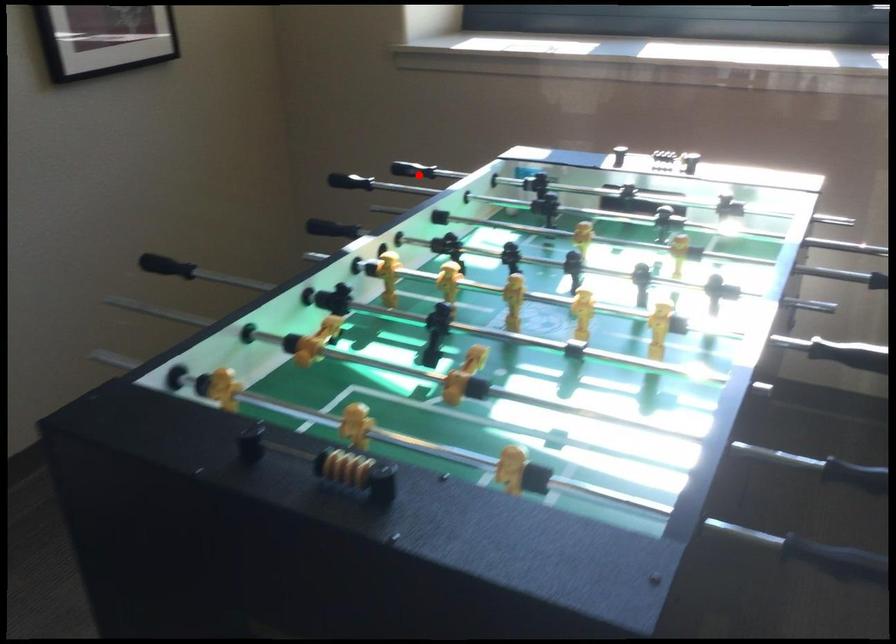
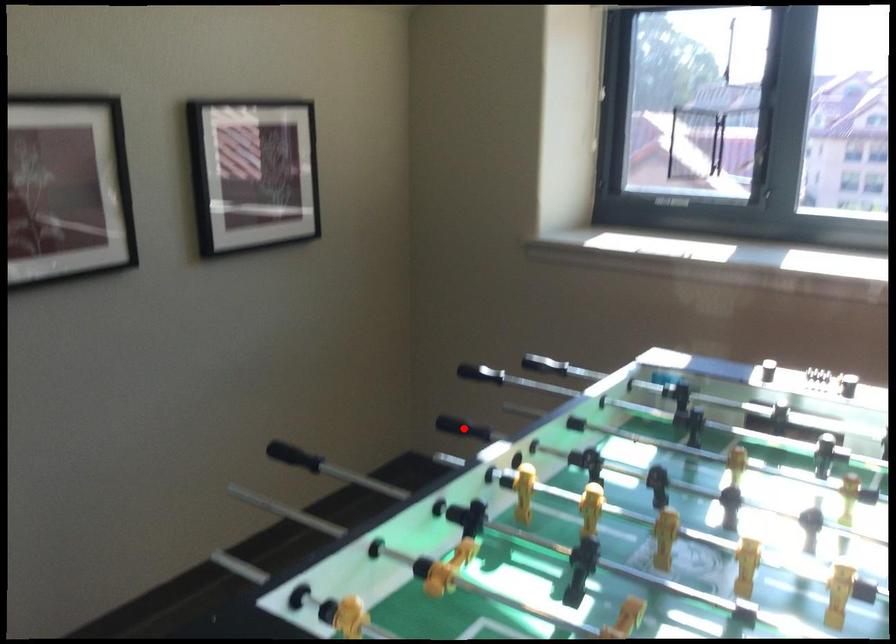
I am providing you with two images of the same scene from different viewpoints. A red point is marked on the first image and another point is marked on the second image. Are the points marked in image1 and image2 representing the same 3D position?

No